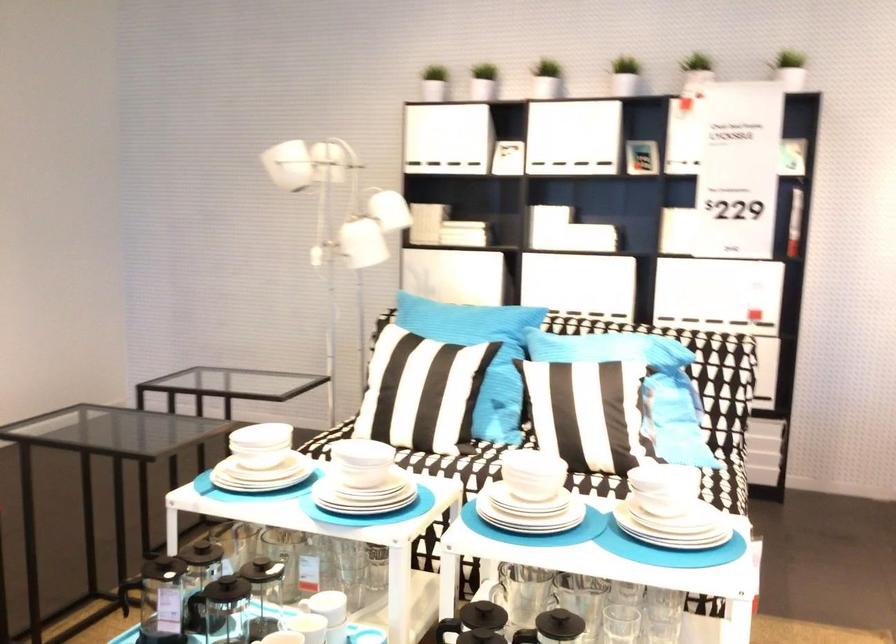
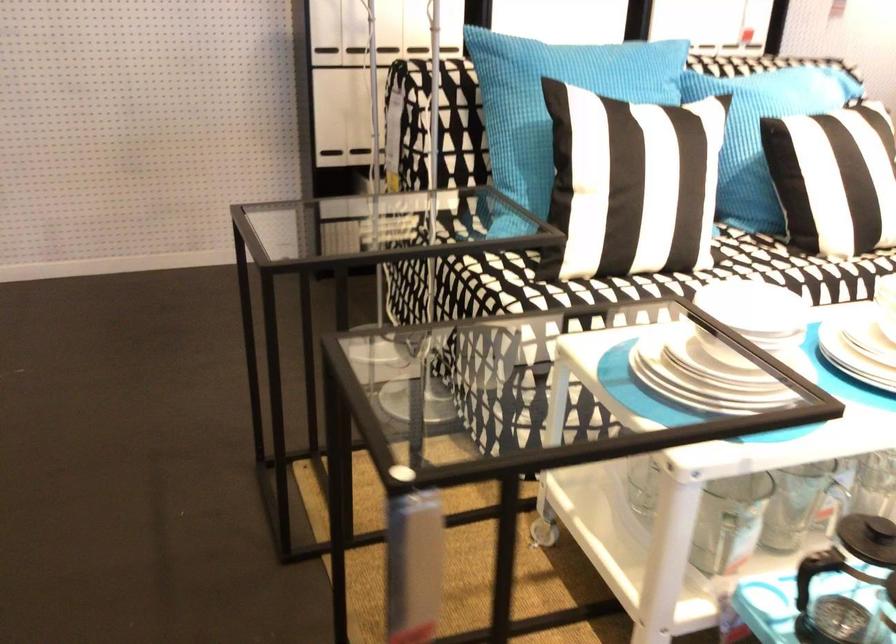
The point at (383, 328) is marked in the first image. Where is the corresponding point in the second image?

(554, 102)